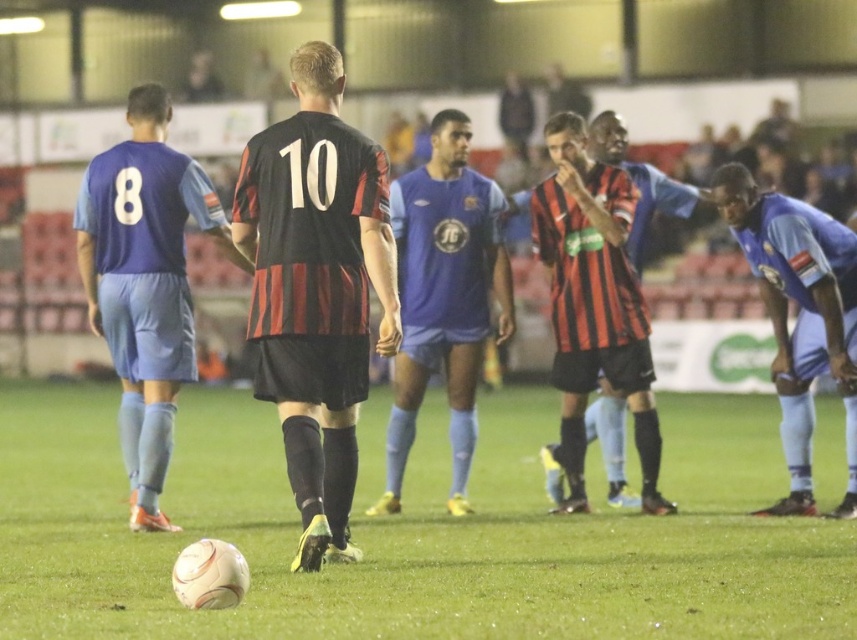
Is point (614, 198) closer to viewer compared to point (772, 328)?

Yes, it is.

Who is shorter, black and red striped jersey at center or blue jersey at right?

blue jersey at right is shorter.

Who is more distant from viewer, (609, 276) or (746, 170)?

Positioned behind is point (746, 170).

Find the location of `black and red striped jersey at center`. black and red striped jersey at center is located at coordinates (592, 301).

Between white matte football at center and blue jersey at right, which one appears on the right side from the viewer's perspective?

Positioned to the right is blue jersey at right.

Does white matte football at center appear on the left side of blue jersey at right?

Yes, white matte football at center is to the left of blue jersey at right.

Locate an element on the screen. This screenshot has width=857, height=640. white matte football at center is located at coordinates (412, 531).

Does black matte jersey at center appear on the right side of black and red striped jersey at center?

Result: No, black matte jersey at center is not to the right of black and red striped jersey at center.

Where is `black matte jersey at center`? black matte jersey at center is located at coordinates (316, 289).